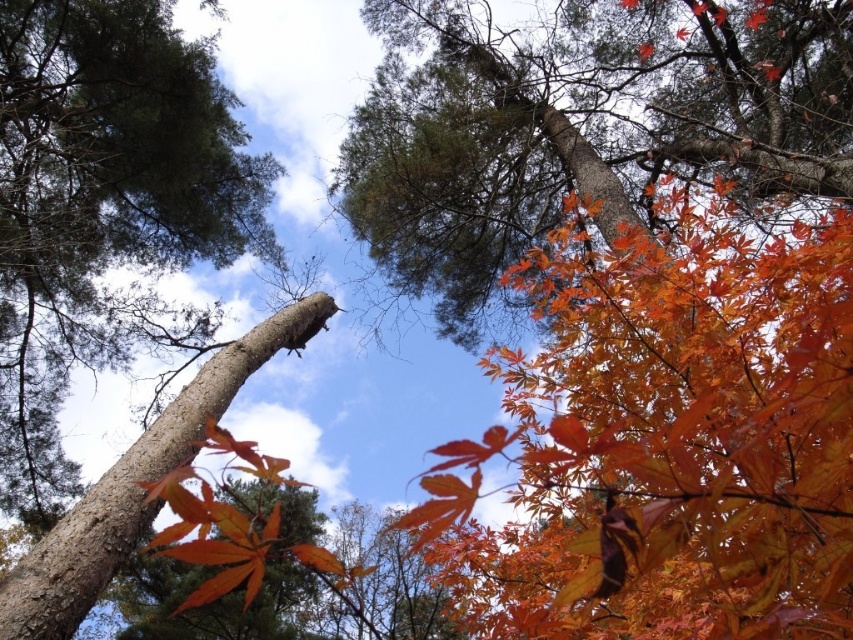
Question: Which object is the farthest from the smooth brown tree trunk at center?

Choices:
 (A) smooth bark tree trunk at left
 (B) orange matte leaves at upper center
 (C) orange matte maple leaf at center

Answer: (C)

Question: Which of these objects is positioned closest to the orange matte maple leaf at center?

Choices:
 (A) smooth brown tree trunk at center
 (B) shiny orange leaves at upper right
 (C) orange matte leaves at upper center

Answer: (B)

Question: Is orange matte leaves at upper center thinner than orange matte maple leaf at center?

Choices:
 (A) yes
 (B) no

Answer: (B)

Question: Which object is farther from the camera taking this photo?

Choices:
 (A) shiny orange leaves at upper right
 (B) orange matte maple leaf at center

Answer: (B)

Question: Is smooth bark tree trunk at left to the right of smooth brown tree trunk at center from the viewer's perspective?

Choices:
 (A) yes
 (B) no

Answer: (B)

Question: Can you confirm if orange matte leaves at upper center is wider than smooth bark tree trunk at left?

Choices:
 (A) no
 (B) yes

Answer: (B)